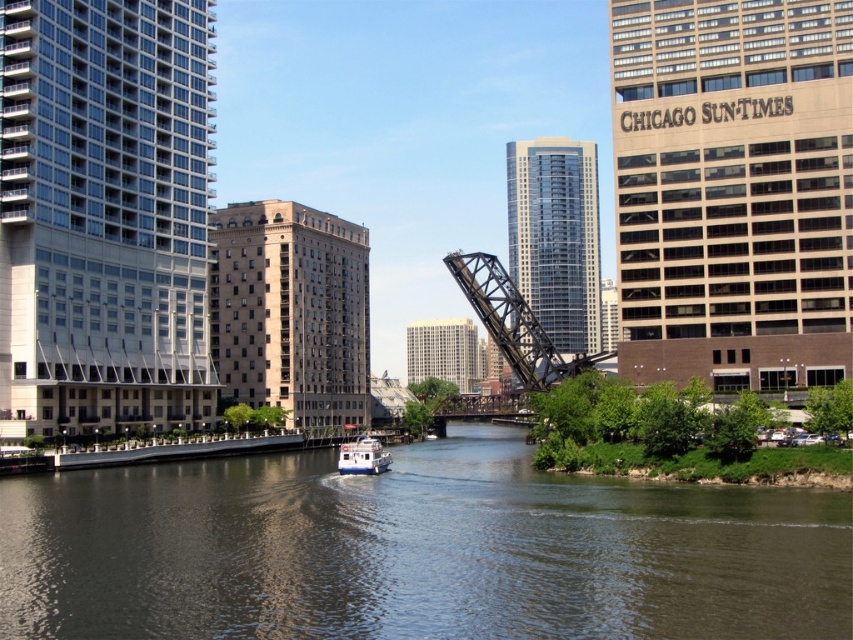
Image resolution: width=853 pixels, height=640 pixels. What do you see at coordinates (415, 552) in the screenshot?
I see `dark gray water at center` at bounding box center [415, 552].

Who is taller, dark gray water at center or white matte boat at center?

white matte boat at center

At what (x,y) coordinates should I click in order to perform the action: click on dark gray water at center. Please return your answer as a coordinate pair (x, y). Image resolution: width=853 pixels, height=640 pixels. Looking at the image, I should click on (415, 552).